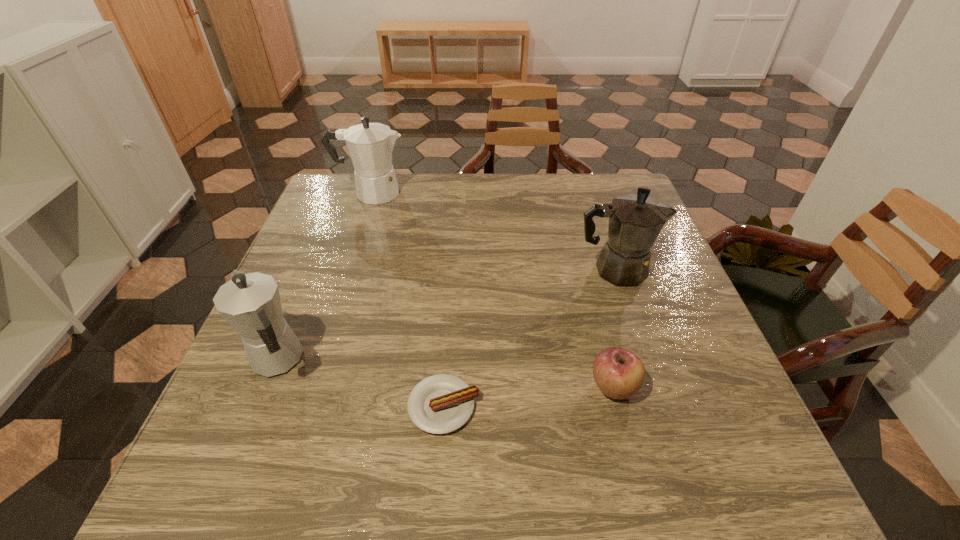
Find the location of `the farthest object`. the farthest object is located at coordinates point(370,145).

Find the location of a particular element. This screenshot has height=540, width=960. the second farthest object is located at coordinates (635, 221).

Where is `the rightmost coffeepot`? The height and width of the screenshot is (540, 960). the rightmost coffeepot is located at coordinates (635, 221).

Where is `the nearest coffeepot`? This screenshot has height=540, width=960. the nearest coffeepot is located at coordinates click(x=250, y=303).

You are a GUI agent. You are given a task and a screenshot of the screen. Output one action in this format:
    pyautogui.click(x=<x>, y=<y>)
    Task: Click on the fourth tallest object
    This screenshot has width=960, height=540.
    Given the screenshot: What is the action you would take?
    pyautogui.click(x=619, y=374)

Locate an element on the screen. The height and width of the screenshot is (540, 960). sausage is located at coordinates (439, 404).

Image resolution: width=960 pixels, height=540 pixels. Identify the location of the shortest object. (439, 404).

The height and width of the screenshot is (540, 960). I want to click on vacant space situated 0.190m at the spout of the farthest coffeepot, so click(x=471, y=193).

I want to click on vacant space located on the back of the nearest coffeepot, so coord(330,235).

At what (x,y) coordinates should I click in order to perform the action: click on vacant space located on the back of the apple. Please return your answer as a coordinate pair (x, y). Looking at the image, I should click on (580, 255).